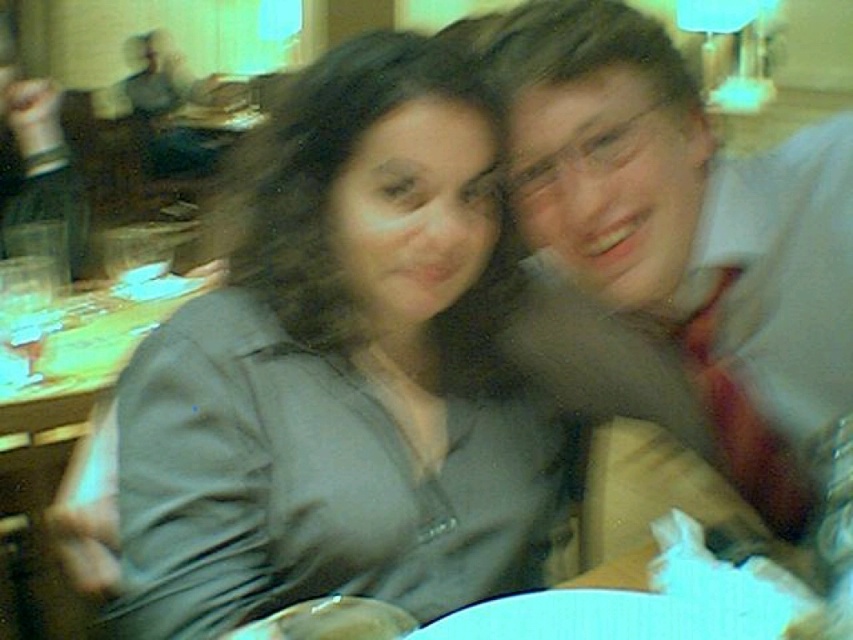
You are a photographer trying to capture a closeup of the wooden table at lower left without including the matte white shirt at upper right in the frame. Is this possible given their positions?

The matte white shirt at upper right is in front of the wooden table at lower left, so it would block the view. Therefore, capturing a closeup of the wooden table at lower left without including the matte white shirt at upper right is not possible unless the shirt is moved or the angle is changed.

You are a waiter at a restaurant and need to place a 24 inch dessert plate between the matte gray shirt at center and the wooden table at lower left. Will the plate fit without overlapping either object?

The distance between the matte gray shirt at center and the wooden table at lower left is 24.46 inches. Since the dessert plate is 24 inches wide, there is enough space to place it between them without overlapping either object.

You are a photographer trying to capture a group photo of the matte gray shirt at center and the matte white shirt at upper right. Since you want to ensure both are in focus, you need to know which one is taller. Can you determine which of the two is taller?

The matte gray shirt at center is taller than the matte white shirt at upper right, so you should adjust the camera settings to focus on the taller one first.